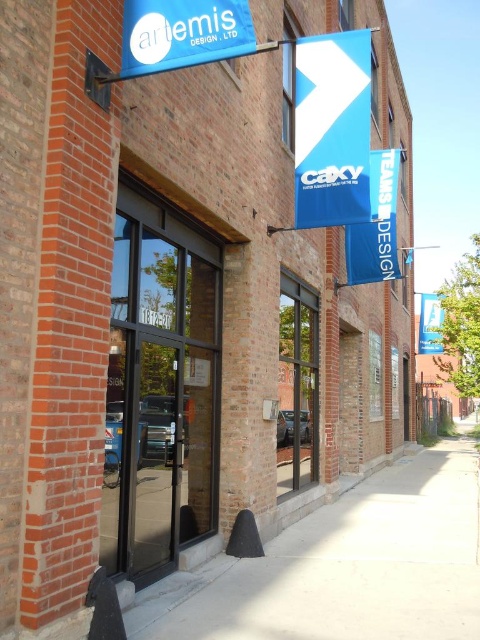
Is smooth concrete sidewalk at center closer to camera compared to blue matte sign at upper center?

That is False.

Is smooth concrete sidewalk at center behind blue matte sign at upper center?

Yes, smooth concrete sidewalk at center is further from the viewer.

You are a GUI agent. You are given a task and a screenshot of the screen. Output one action in this format:
    pyautogui.click(x=<x>, y=<y>)
    Task: Click on the smooth concrete sidewalk at center
    The width and height of the screenshot is (480, 640).
    Given the screenshot: What is the action you would take?
    pyautogui.click(x=346, y=566)